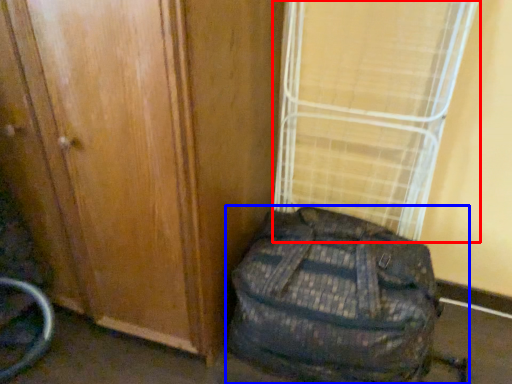
Question: Which object is further to the camera taking this photo, curtain (highlighted by a red box) or backpack (highlighted by a blue box)?

Choices:
 (A) curtain
 (B) backpack

Answer: (A)